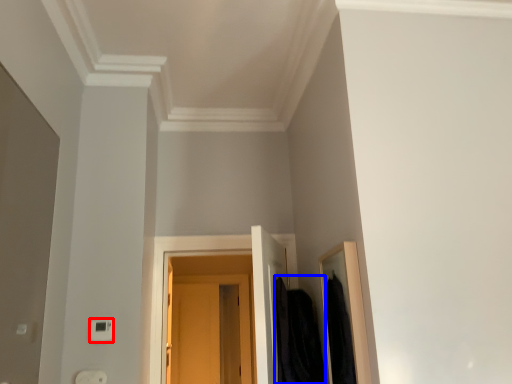
Question: Which of the following is the farthest to the observer, light switch (highlighted by a red box) or clothing (highlighted by a blue box)?

Choices:
 (A) light switch
 (B) clothing

Answer: (A)